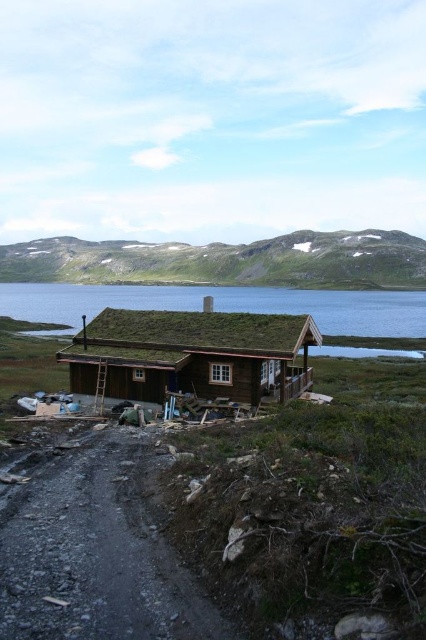
Looking at this image, who is lower down, dusty gravel path at lower left or brown wooden log cabin at center?

Positioned lower is dusty gravel path at lower left.

Who is shorter, dusty gravel path at lower left or brown wooden log cabin at center?

dusty gravel path at lower left

The width and height of the screenshot is (426, 640). What do you see at coordinates (97, 554) in the screenshot? I see `dusty gravel path at lower left` at bounding box center [97, 554].

The width and height of the screenshot is (426, 640). Find the location of `dusty gravel path at lower left`. dusty gravel path at lower left is located at coordinates (97, 554).

Which is in front, point (103, 388) or point (23, 292)?

Point (103, 388) is more forward.

Does brown wooden log cabin at center appear under clear blue water at center?

Indeed, brown wooden log cabin at center is positioned under clear blue water at center.

The image size is (426, 640). I want to click on brown wooden log cabin at center, so click(x=190, y=355).

Between dusty gravel path at lower left and clear blue water at center, which one appears on the left side from the viewer's perspective?

clear blue water at center is more to the left.

Between point (36, 580) and point (115, 298), which one is positioned behind?

Point (115, 298)

At what (x,y) coordinates should I click in order to perform the action: click on dusty gravel path at lower left. Please return your answer as a coordinate pair (x, y). Looking at the image, I should click on (97, 554).